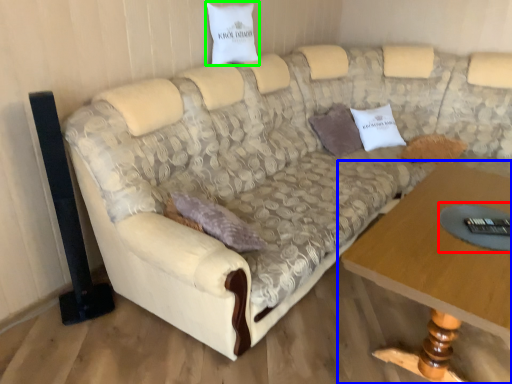
Question: Considering the real-world distances, which object is farthest from glass table (highlighted by a red box)? table (highlighted by a blue box) or pillow (highlighted by a green box)?

Choices:
 (A) table
 (B) pillow

Answer: (B)